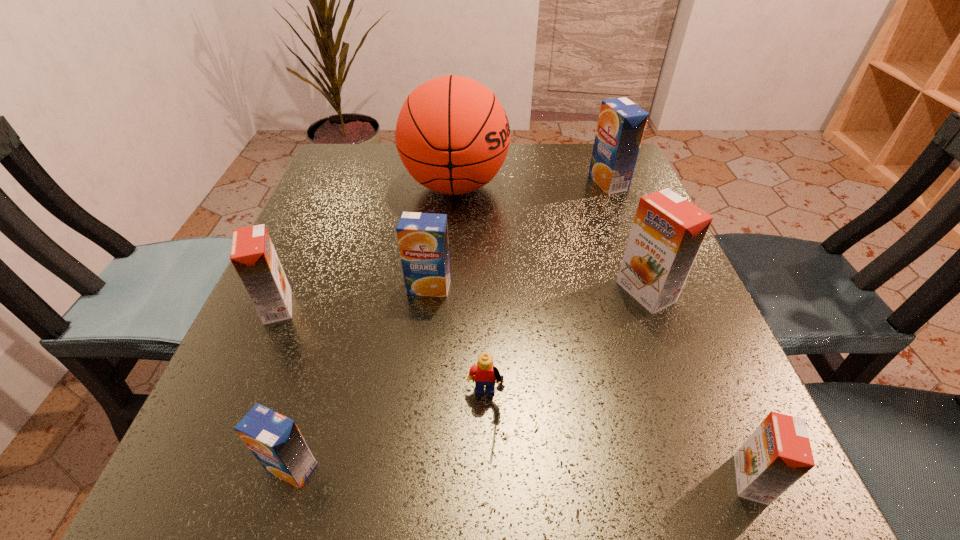
The image size is (960, 540). In order to click on free point between the second smallest blue orange_juice and the seventh object from right to left in this screenshot , I will do `click(361, 377)`.

Identify which object is the sixth nearest to the fourth orange juice from right to left. Please provide its 2D coordinates. Your answer should be formatted as a tuple, i.e. [(x, y)], where the tuple contains the x and y coordinates of a point satisfying the conditions above.

[(621, 124)]

Select which object is the second closest to the leftmost blue orange_juice. Please provide its 2D coordinates. Your answer should be formatted as a tuple, i.e. [(x, y)], where the tuple contains the x and y coordinates of a point satisfying the conditions above.

[(253, 255)]

This screenshot has height=540, width=960. In order to click on orange juice that is the second closest to the smallest orange orange juice in this screenshot , I will do `click(422, 237)`.

What are the coordinates of `orange juice identified as the closest to the leftmost orange orange juice` in the screenshot? It's located at (422, 237).

Identify which blue orange_juice is the third closest to the smallest orange orange juice. Please provide its 2D coordinates. Your answer should be formatted as a tuple, i.e. [(x, y)], where the tuple contains the x and y coordinates of a point satisfying the conditions above.

[(621, 124)]

Image resolution: width=960 pixels, height=540 pixels. In order to click on blue orange_juice that is the third closest to the biggest orange orange juice in this screenshot , I will do `click(275, 440)`.

Select which orange orange juice is the third closest to the basketball. Please provide its 2D coordinates. Your answer should be formatted as a tuple, i.e. [(x, y)], where the tuple contains the x and y coordinates of a point satisfying the conditions above.

[(778, 453)]

Locate an element on the screen. This screenshot has height=540, width=960. orange orange juice that is the closest to the biggest orange orange juice is located at coordinates (778, 453).

Find the location of a particular element. The image size is (960, 540). vacant space that satisfies the following two spatial constraints: 1. on the side with logo of the tallest object; 2. on the back side of the smallest orange orange juice is located at coordinates (434, 479).